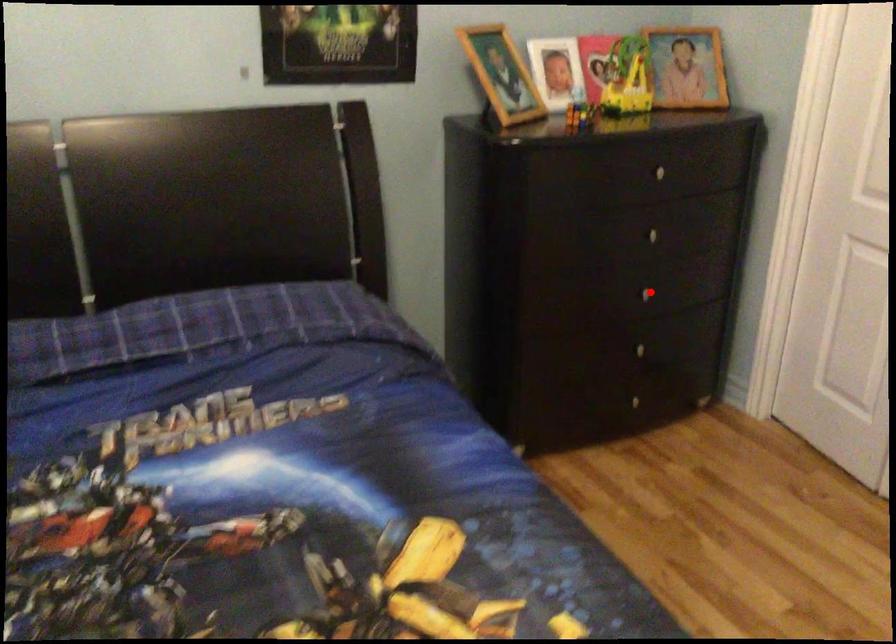
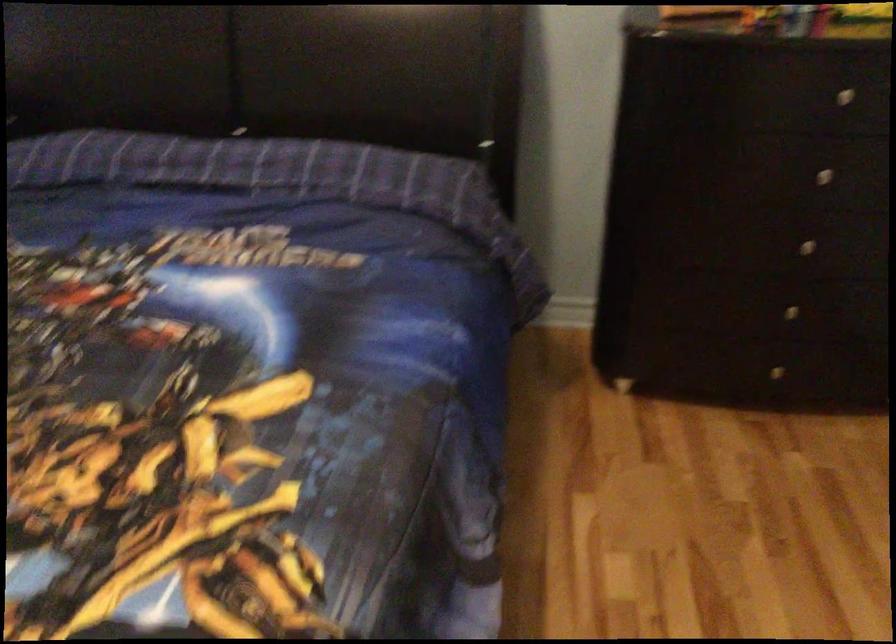
Question: I am providing you with two images of the same scene from different viewpoints. Image1 has a red point marked. In image2, the corresponding 3D location appears at what relative position? Reply with the corresponding letter.

Choices:
 (A) Closer
 (B) Farther

Answer: (A)